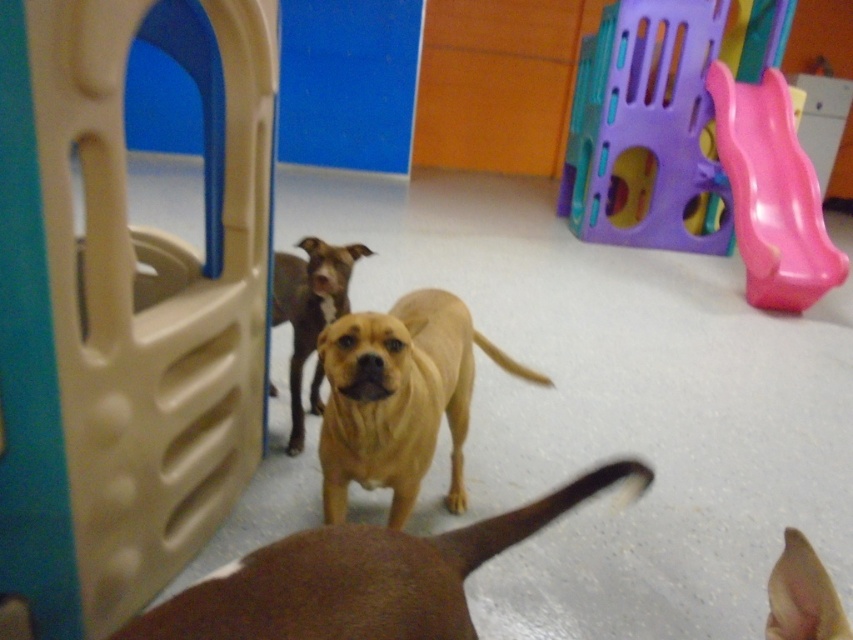
Question: Can you confirm if beige plastic playhouse at left is wider than golden smooth dog at center?

Choices:
 (A) yes
 (B) no

Answer: (B)

Question: Considering the relative positions of brown matte dog at center and brown matte dog at lower right in the image provided, where is brown matte dog at center located with respect to brown matte dog at lower right?

Choices:
 (A) right
 (B) left

Answer: (B)

Question: Can you confirm if beige plastic playhouse at left is bigger than brown matte dog at lower right?

Choices:
 (A) no
 (B) yes

Answer: (B)

Question: Which point appears farthest from the camera in this image?

Choices:
 (A) (250, 58)
 (B) (309, 396)

Answer: (B)

Question: Which object is farther from the camera taking this photo?

Choices:
 (A) golden brown fur at center
 (B) golden smooth dog at center
 (C) pink plastic slide at right

Answer: (C)

Question: Estimate the real-world distances between objects in this image. Which object is farther from the golden brown fur at center?

Choices:
 (A) brown matte dog at lower right
 (B) golden smooth dog at center

Answer: (A)